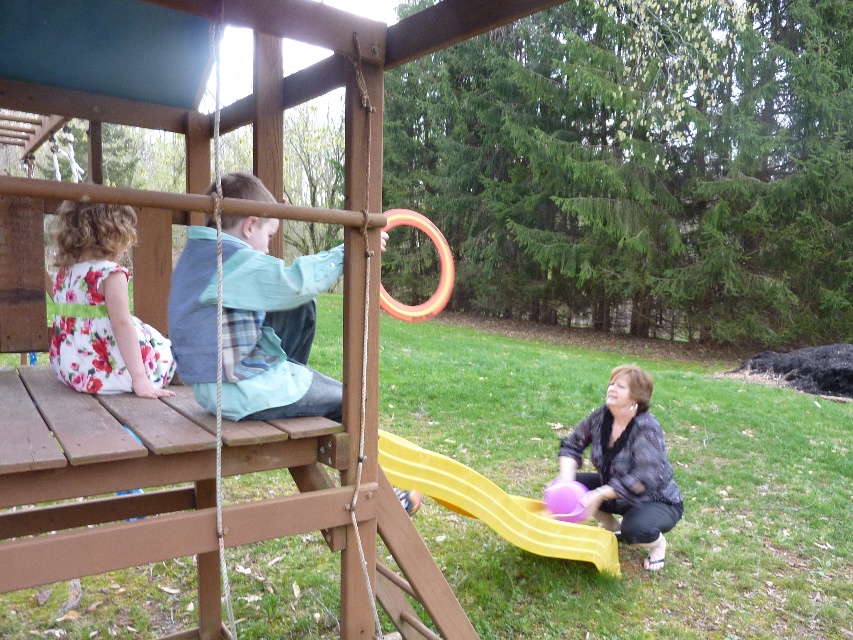
Measure the distance from light blue denim jacket at left to purple matte balloon at lower right.

The distance of light blue denim jacket at left from purple matte balloon at lower right is 8.15 feet.

Who is higher up, light blue denim jacket at left or purple matte balloon at lower right?

light blue denim jacket at left is above.

Is point (212, 333) positioned in front of point (618, 493)?

That is True.

Image resolution: width=853 pixels, height=640 pixels. Find the location of `light blue denim jacket at left`. light blue denim jacket at left is located at coordinates (271, 326).

Is light blue denim jacket at left shorter than orange rubber ring at upper center?

Correct, light blue denim jacket at left is not as tall as orange rubber ring at upper center.

Does point (252, 278) come closer to viewer compared to point (419, 220)?

Yes, point (252, 278) is in front of point (419, 220).

This screenshot has height=640, width=853. In order to click on light blue denim jacket at left in this screenshot , I will do `click(271, 326)`.

Who is higher up, yellow plastic slide at lower center or orange rubber ring at upper center?

Positioned higher is orange rubber ring at upper center.

Which is more to the left, yellow plastic slide at lower center or orange rubber ring at upper center?

Positioned to the left is orange rubber ring at upper center.

Between point (532, 536) and point (431, 294), which one is positioned in front?

Point (532, 536)

I want to click on yellow plastic slide at lower center, so click(492, 504).